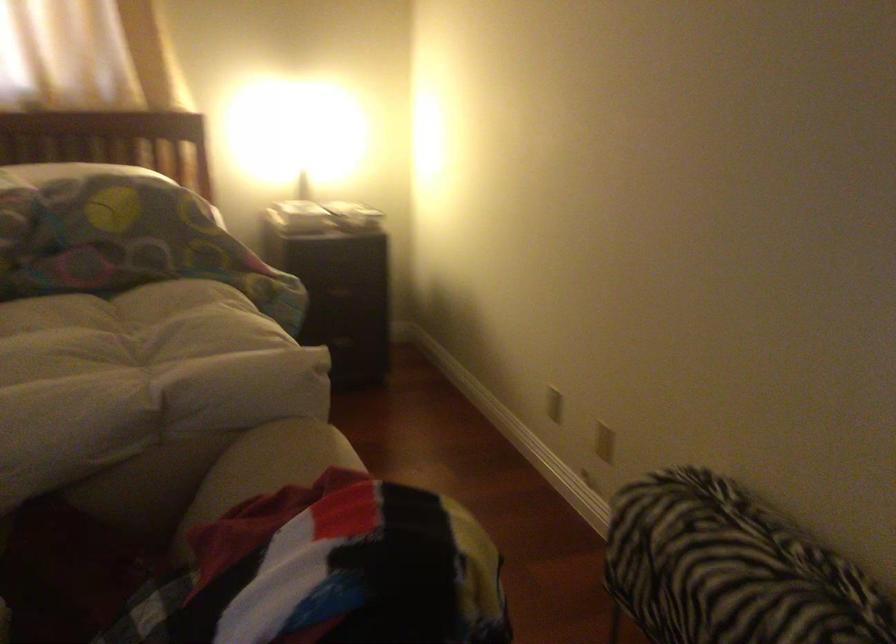
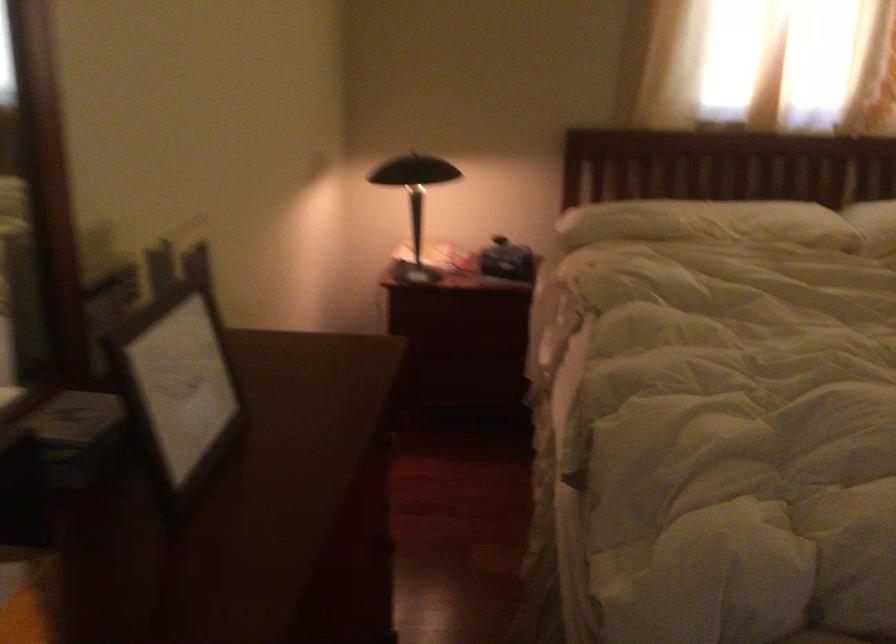
Question: What movement of the cameraman would produce the second image?

Choices:
 (A) Left
 (B) Right
 (C) Forward
 (D) Backward

Answer: (A)